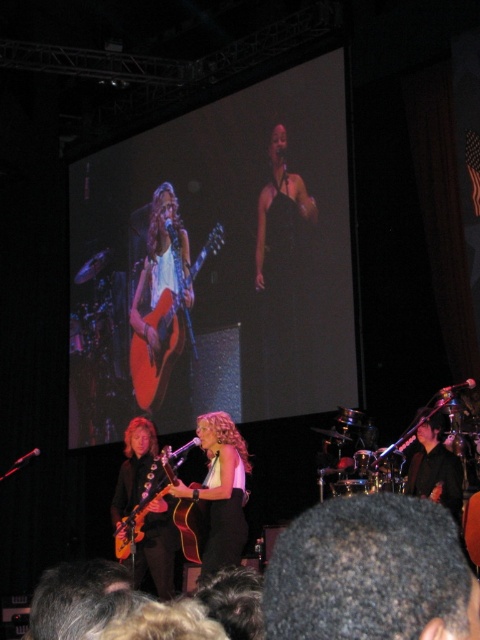
You are a photographer trying to capture the shiny gold guitar at center during a live music performance. The stage has dim lighting, but you notice the guitar is positioned at specific coordinates. Based on its location, can you determine if the guitar is closer to the front of the stage or the back?

The shiny gold guitar at center is located at point 0.767 on the x and 0.460 on the y coordinates. Since the coordinates are closer to the front of the stage, the guitar is positioned near the front.

You are a stagehand who needs to place a new microphone stand between the shiny gold guitar at center and the orange matte acoustic guitar at center. Given that the microphone stand requires 1 meter of space, can you fit it between them based on their widths?

The shiny gold guitar at center is narrower than the orange matte acoustic guitar at center. However, the description only provides information about their widths relative to each other, not the actual distance between them. Without knowing the exact spacing between the guitars, it is impossible to determine if the 1 meter requirement can be met.

You are a photographer at the concert and need to capture a closeup shot of both the shiny gold guitar at center and the orange matte acoustic guitar at center. Which guitar should you zoom in on more to ensure both fit in the frame?

The shiny gold guitar at center is smaller than the orange matte acoustic guitar at center, so you should zoom in more on the orange matte acoustic guitar at center to accommodate its larger size while still including the smaller shiny gold guitar at center in the frame.